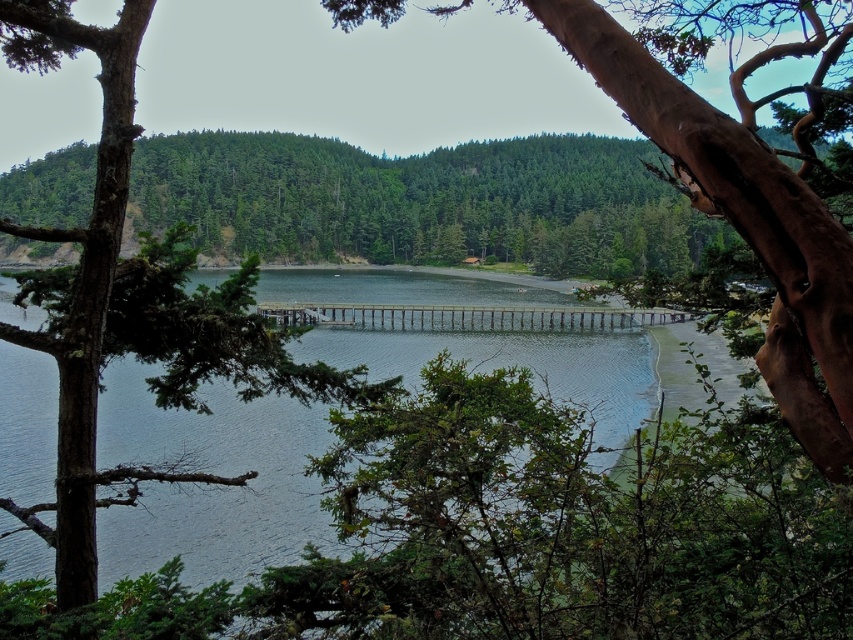
Question: Among these objects, which one is nearest to the camera?

Choices:
 (A) clear water at center
 (B) brown rough tree trunk at center

Answer: (B)

Question: Which point is closer to the camera?

Choices:
 (A) brown rough tree trunk at center
 (B) clear water at center

Answer: (A)

Question: Can you confirm if clear water at center is thinner than brown rough tree trunk at center?

Choices:
 (A) yes
 (B) no

Answer: (B)

Question: In this image, where is clear water at center located relative to brown rough tree trunk at center?

Choices:
 (A) above
 (B) below

Answer: (B)

Question: Is clear water at center to the left of brown rough tree trunk at center from the viewer's perspective?

Choices:
 (A) no
 (B) yes

Answer: (B)